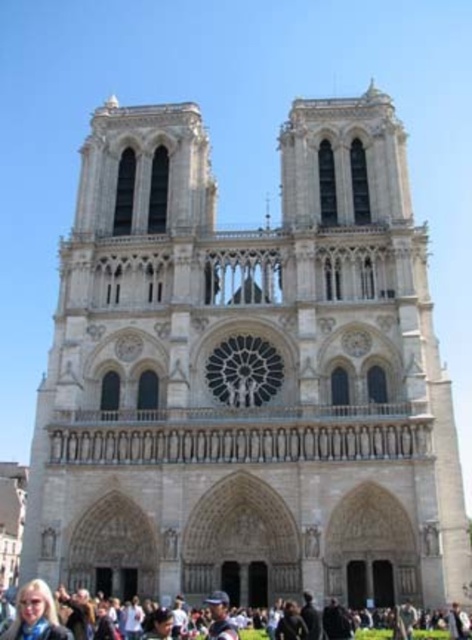
Is dark gray concrete crowd at lower center taller than blonde hair at lower left?

No.

Who is more forward, (466,618) or (53,616)?

Point (53,616) is more forward.

At what (x,y) coordinates should I click in order to perform the action: click on dark gray concrete crowd at lower center. Please return your answer as a coordinate pair (x, y). This screenshot has height=640, width=472. Looking at the image, I should click on (50, 616).

What are the coordinates of `dark gray concrete crowd at lower center` in the screenshot? It's located at (50, 616).

Does point (57, 620) lie in front of point (209, 634)?

Yes, it is.

Does blonde hair at lower left lie behind light blue fabric at lower center?

No, blonde hair at lower left is in front of light blue fabric at lower center.

Is point (43, 609) farther from camera compared to point (220, 634)?

No.

The width and height of the screenshot is (472, 640). I want to click on blonde hair at lower left, so click(x=35, y=614).

Does dark gray concrete crowd at lower center have a smaller size compared to light blue fabric at lower center?

No.

Which is behind, point (35, 636) or point (210, 634)?

Positioned behind is point (210, 634).

You are a GUI agent. You are given a task and a screenshot of the screen. Output one action in this format:
    pyautogui.click(x=<x>, y=<y>)
    Task: Click on the dark gray concrete crowd at lower center
    
    Given the screenshot: What is the action you would take?
    pyautogui.click(x=50, y=616)